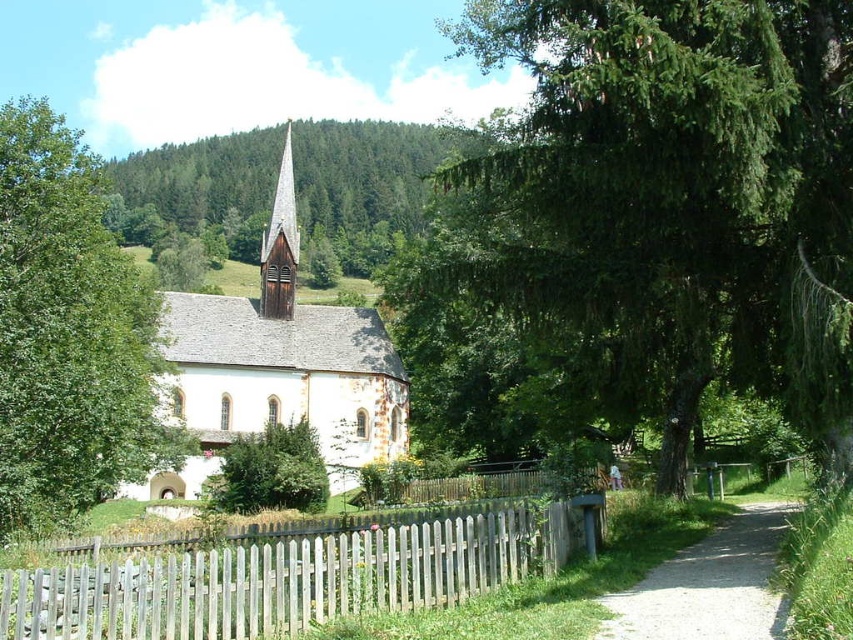
You are standing in front of the church and notice two points marked on the ground. The first point is at coordinates point (845, 193) and the second point is at point (173, 209). Which point is closer to your current position?

Point (845, 193) is closer to the camera than point (173, 209), so the first point is closer to your current position.